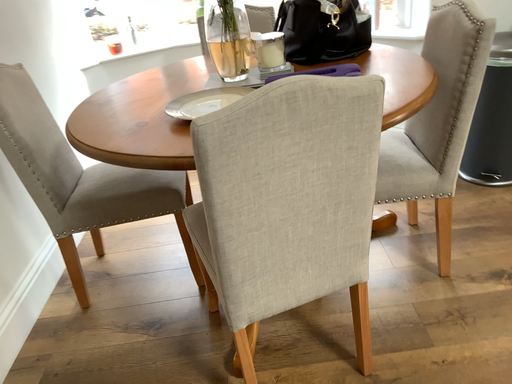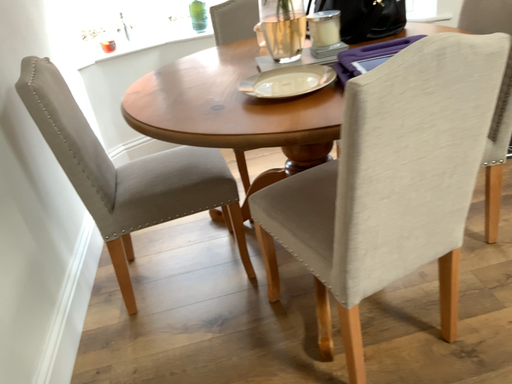
Question: Which way did the camera rotate in the video?

Choices:
 (A) rotated left
 (B) rotated right

Answer: (B)